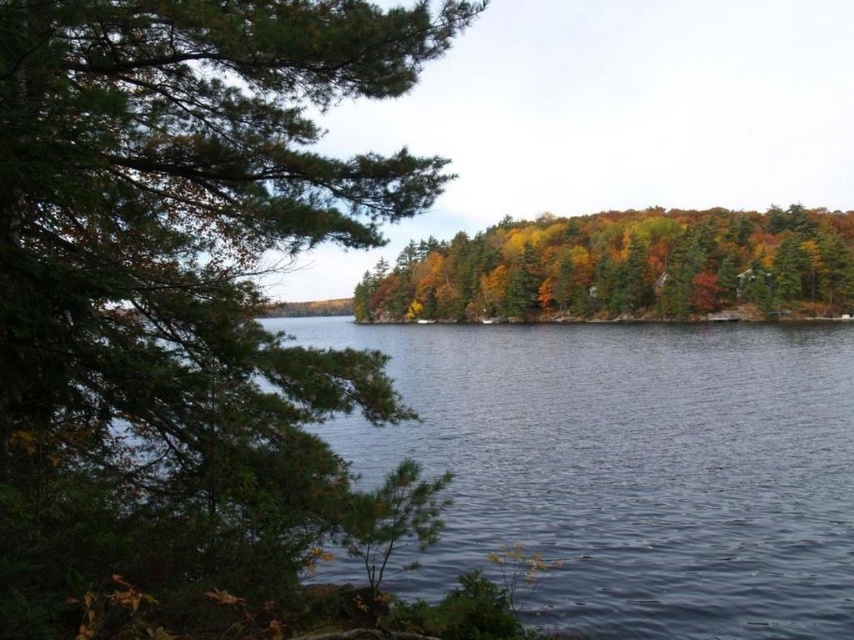
Question: Does green matte tree at left have a greater width compared to autumn leaves at center?

Choices:
 (A) yes
 (B) no

Answer: (B)

Question: Which of the following is the farthest from the observer?

Choices:
 (A) green matte tree at left
 (B) autumn leaves at center

Answer: (B)

Question: Which point is farther to the camera?

Choices:
 (A) (x=162, y=163)
 (B) (x=402, y=259)

Answer: (B)

Question: Which point is closer to the camera?

Choices:
 (A) (297, 113)
 (B) (513, 291)

Answer: (A)

Question: Is green matte tree at left closer to camera compared to autumn leaves at center?

Choices:
 (A) yes
 (B) no

Answer: (A)

Question: Is green matte tree at left positioned in front of autumn leaves at center?

Choices:
 (A) no
 (B) yes

Answer: (B)